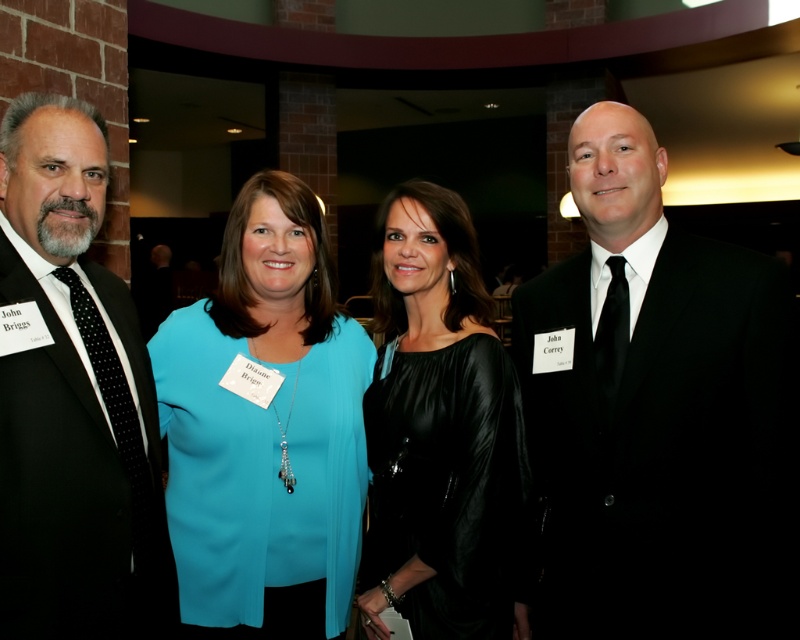
You are a photographer at the event and want to ensure that both the black suit at right and the teal fabric blouse at center are visible in the frame. Given their sizes, which one might require more careful positioning to avoid being cropped out?

The black suit at right has a larger size compared to the teal fabric blouse at center, so it might require more careful positioning to avoid being cropped out due to its larger size.

You are a photographer at the event and need to adjust the lighting between the two men in black suits. Given that your equipment requires a minimum of 1 meter between the subjects to function properly, can you safely operate it between the black suit at right and the black suit at left?

The distance between the black suit at right and the black suit at left is 1.02 meters, which meets the minimum requirement of 1 meter. Therefore, you can safely operate the equipment between them.